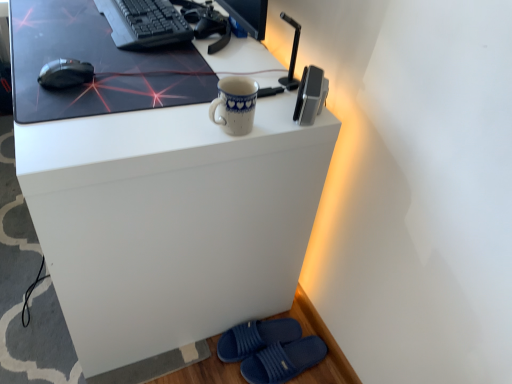
The width and height of the screenshot is (512, 384). Find the location of `free spot behind blue porcelain mug at upper center`. free spot behind blue porcelain mug at upper center is located at coordinates (258, 86).